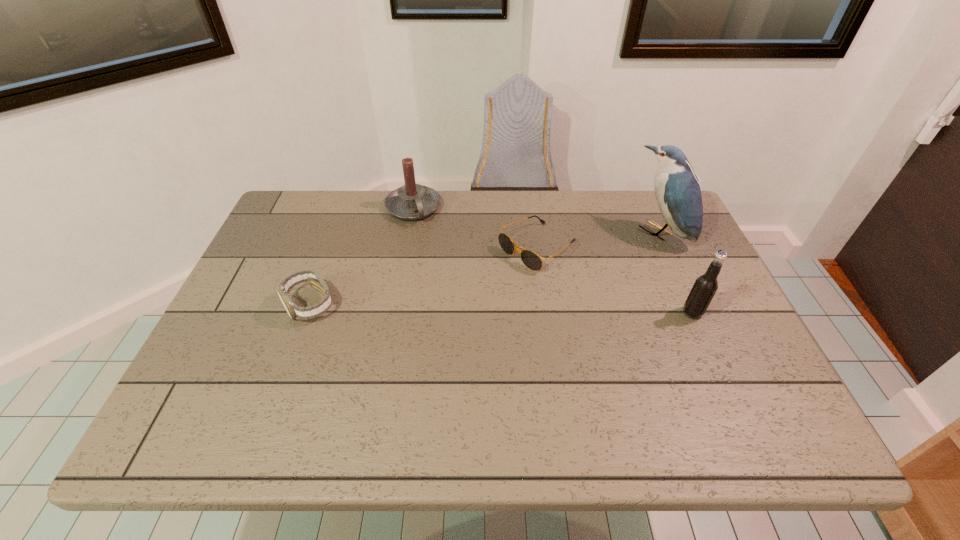
Find the location of a particular element. Image resolution: width=960 pixels, height=540 pixels. vacant space on the desktop that is between the second shortest object and the root beer and is positioned on the front-facing side of the sunglasses is located at coordinates (449, 308).

The image size is (960, 540). Find the location of `free space on the desktop that is between the leftmost object and the root beer and is positioned on the side of the candle with the handle loop`. free space on the desktop that is between the leftmost object and the root beer and is positioned on the side of the candle with the handle loop is located at coordinates (460, 308).

Where is `vacant spot on the desktop that is between the watch and the root beer and is positioned at the tip of the bird's beak`? The width and height of the screenshot is (960, 540). vacant spot on the desktop that is between the watch and the root beer and is positioned at the tip of the bird's beak is located at coordinates (553, 310).